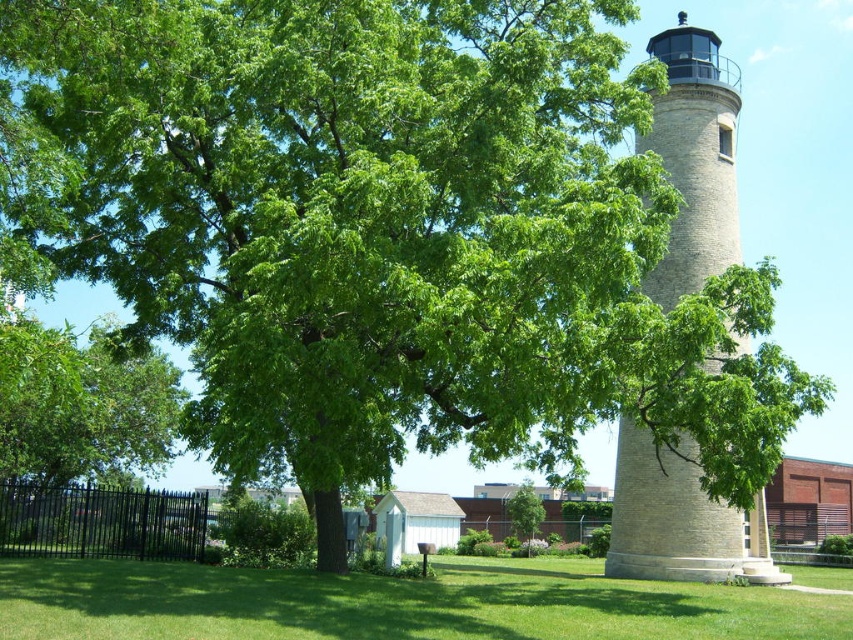
Question: Which is nearer to the green grass at lower center?

Choices:
 (A) green leafy tree at left
 (B) beige stone lighthouse at right
 (C) green leafy tree at center

Answer: (B)

Question: Is beige stone lighthouse at right further to camera compared to green leafy tree at center?

Choices:
 (A) yes
 (B) no

Answer: (B)

Question: Which point is farther from the camera taking this photo?

Choices:
 (A) (601, 625)
 (B) (16, 420)
 (C) (523, 536)

Answer: (C)

Question: Does green leafy tree at left appear on the right side of green leafy tree at center?

Choices:
 (A) no
 (B) yes

Answer: (A)

Question: Is the position of green grass at lower center more distant than that of beige stone lighthouse at right?

Choices:
 (A) yes
 (B) no

Answer: (B)

Question: Which point is closer to the camera?

Choices:
 (A) (534, 529)
 (B) (90, 452)
 (C) (691, 156)

Answer: (C)